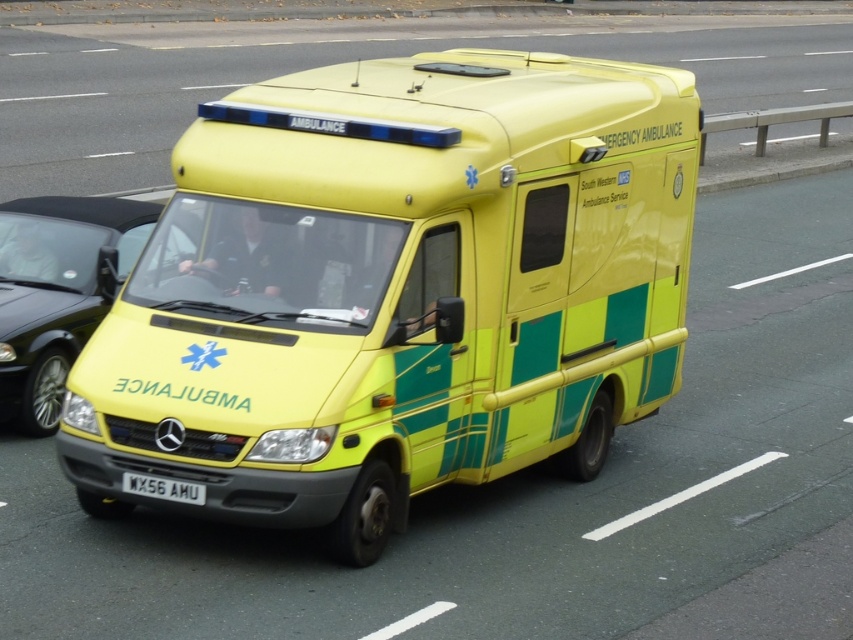
You are a traffic officer observing the yellow matte ambulance at center and the white plastic license plate at center. Which object is wider?

The yellow matte ambulance at center is wider than the white plastic license plate at center.